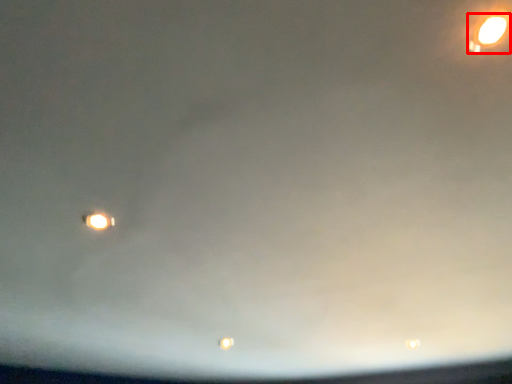
Question: Observing the image, what is the correct spatial positioning of street light (annotated by the red box) in reference to street light?

Choices:
 (A) left
 (B) right

Answer: (B)